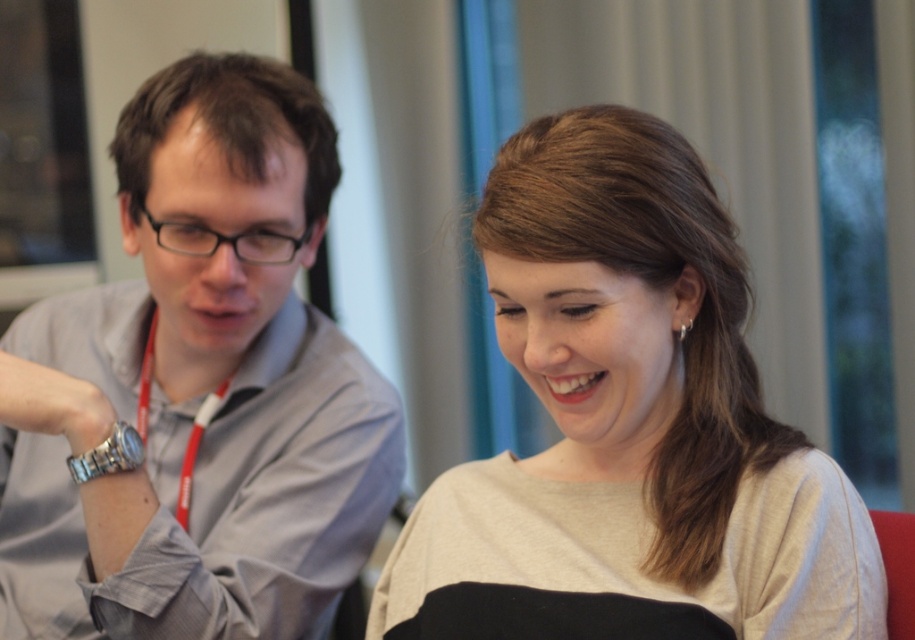
Between gray fabric shirt at left and light beige sweater at center, which one is positioned lower?

light beige sweater at center is below.

Find the location of a particular element. gray fabric shirt at left is located at coordinates (197, 387).

Where is `gray fabric shirt at left`? gray fabric shirt at left is located at coordinates (197, 387).